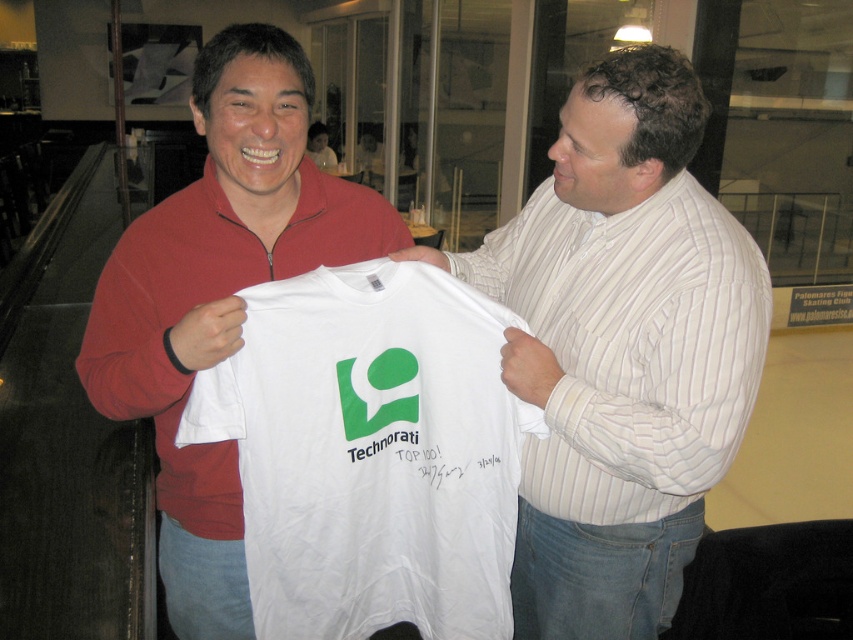
You are an assistant who needs to locate the white cotton shirt at center in the image. According to the coordinates provided, where exactly is it positioned?

The white cotton shirt at center is located at point 0.547 along the x and 0.729 along the y axis.